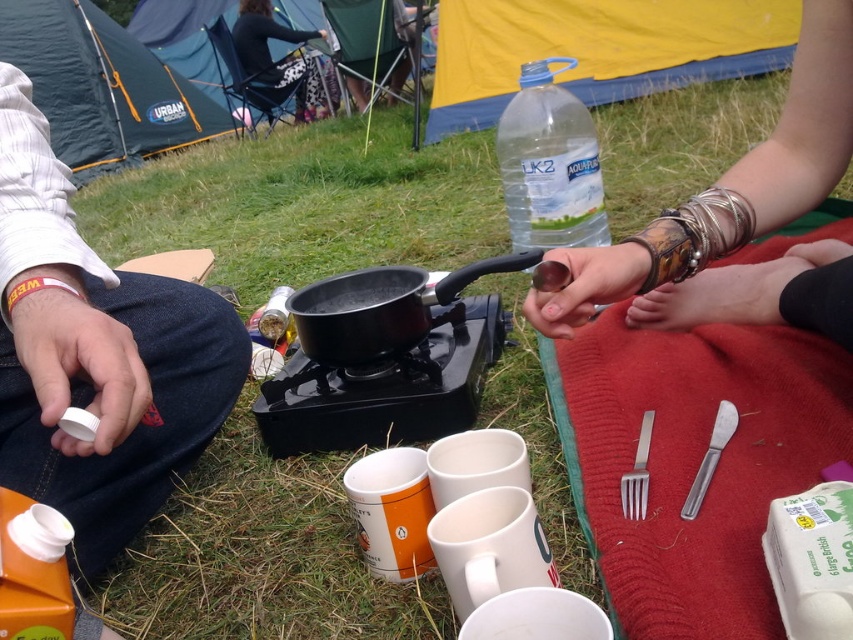
Does blue fabric tent at upper left appear under black matte frying pan at center?

No, blue fabric tent at upper left is not below black matte frying pan at center.

Measure the distance between point [202,115] and camera.

They are 5.96 meters apart.

This screenshot has height=640, width=853. Identify the location of blue fabric tent at upper left. (102, 88).

Is leather bracelet at upper center thinner than black matte frying pan at center?

Incorrect, leather bracelet at upper center's width is not less than black matte frying pan at center's.

Between leather bracelet at upper center and black matte frying pan at center, which one is positioned higher?

Positioned higher is leather bracelet at upper center.

Locate an element on the screen. leather bracelet at upper center is located at coordinates (734, 221).

Who is positioned more to the left, yellow fabric tent at upper center or black matte frying pan at center?

Positioned to the left is black matte frying pan at center.

I want to click on yellow fabric tent at upper center, so click(x=598, y=49).